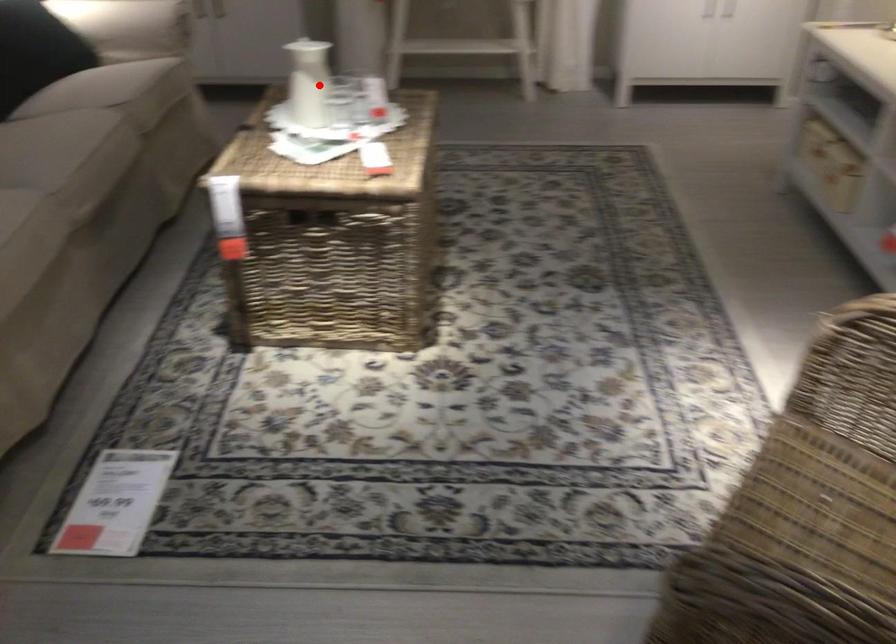
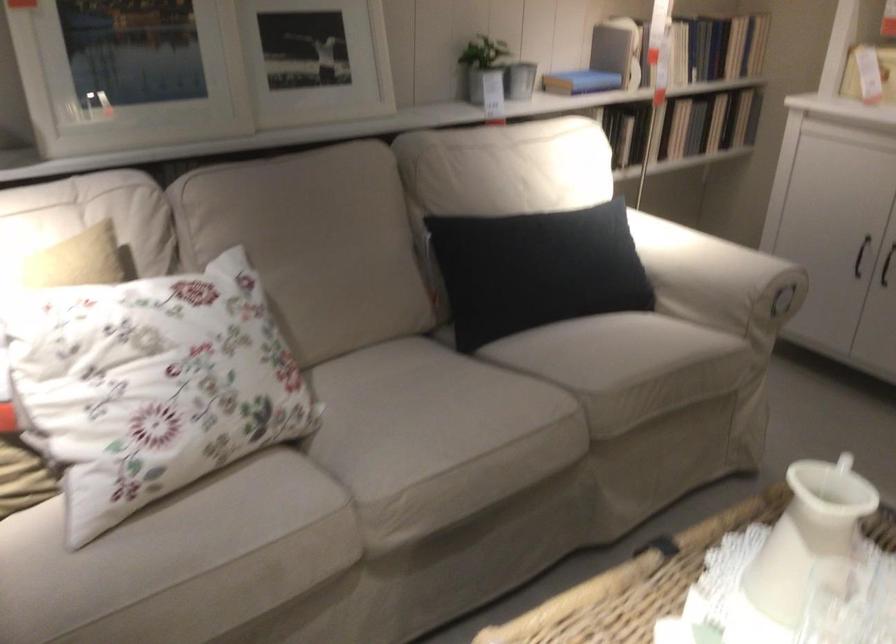
Locate, in the second image, the point that corresponds to the highlighted location in the first image.

(803, 552)